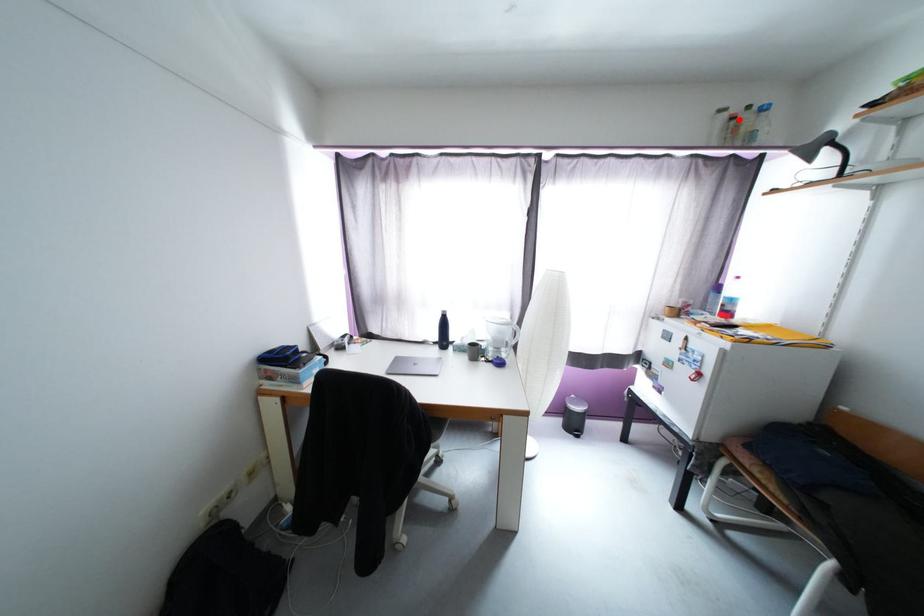
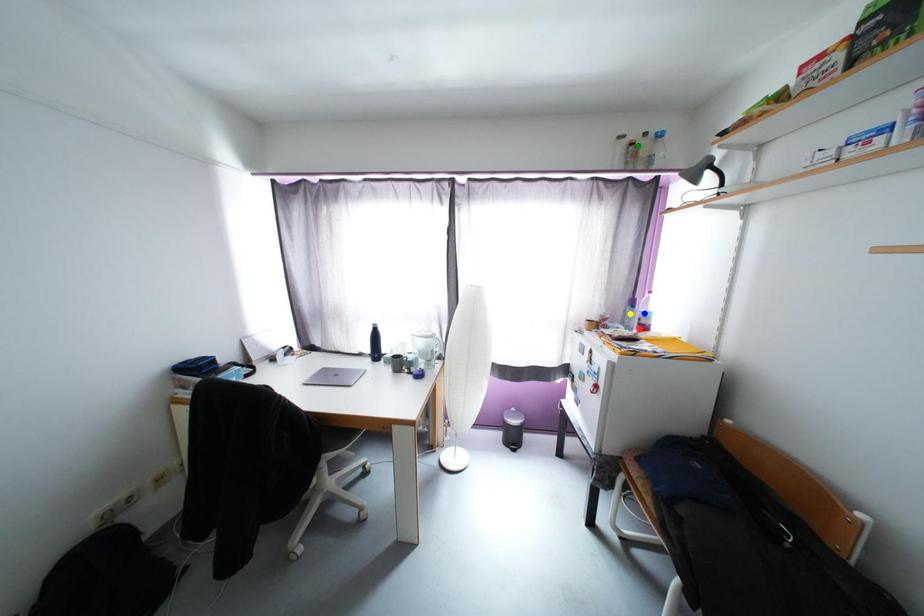
Question: I am providing you with two images of the same scene from different viewpoints. A red point is marked on the first image. You are given multiple points on the second image. Which spot in image 2 lines up with the point in image 1?

Choices:
 (A) green point
 (B) blue point
 (C) yellow point

Answer: (A)